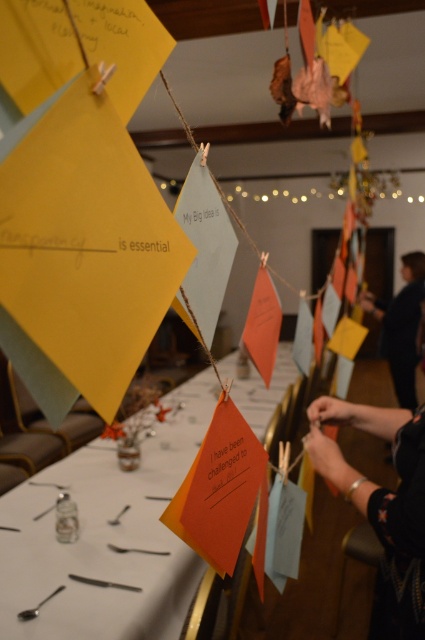
Which of these two, orange paper tag at center or black fabric hand at lower right, stands shorter?

black fabric hand at lower right is shorter.

Which is more to the left, orange paper tag at center or black fabric hand at lower right?

orange paper tag at center

Which is in front, point (90, 464) or point (411, 488)?

Positioned in front is point (411, 488).

Find the location of a particular element. The image size is (425, 640). orange paper tag at center is located at coordinates (105, 538).

Which is more to the left, black fabric hand at lower right or dark blue fabric at upper right?

Positioned to the left is black fabric hand at lower right.

Is point (362, 497) closer to camera compared to point (408, 269)?

Yes, it is in front of point (408, 269).

Is point (410, 563) positioned in front of point (367, 310)?

Yes, it is.

In order to click on black fabric hand at lower right in this screenshot , I will do pos(382,506).

Does orange paper tag at center appear on the left side of dark blue fabric at upper right?

Correct, you'll find orange paper tag at center to the left of dark blue fabric at upper right.

I want to click on orange paper tag at center, so click(105, 538).